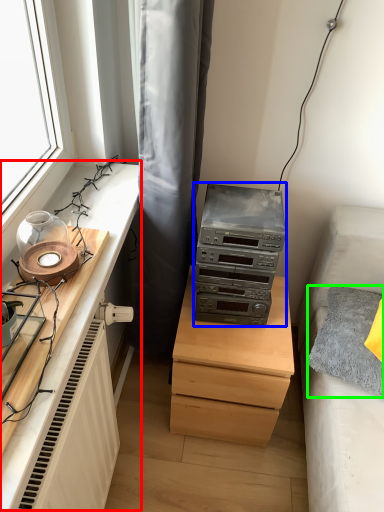
Question: Based on their relative distances, which object is nearer to entertainment center (highlighted by a red box)? Choose from stereo (highlighted by a blue box) and pillow (highlighted by a green box).

Choices:
 (A) stereo
 (B) pillow

Answer: (A)